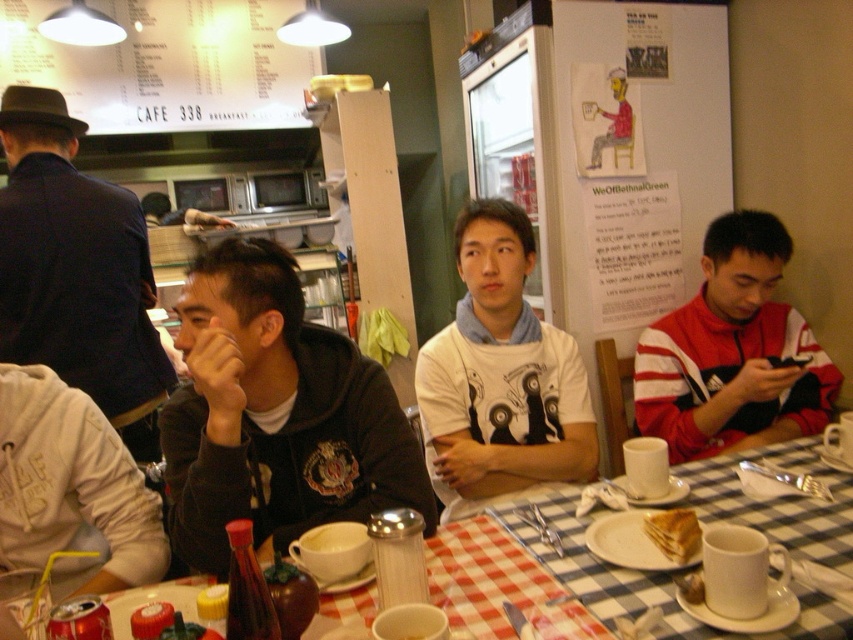
Question: Considering the relative positions of white matte t-shirt at center and checkered fabric tablecloth at lower center in the image provided, where is white matte t-shirt at center located with respect to checkered fabric tablecloth at lower center?

Choices:
 (A) left
 (B) right

Answer: (A)

Question: Which object appears closest to the camera in this image?

Choices:
 (A) checkered fabric table at center
 (B) golden crispy pastry at lower center
 (C) red and white striped hoodie at right
 (D) checkered fabric tablecloth at lower center

Answer: (D)

Question: Which object appears closest to the camera in this image?

Choices:
 (A) white matte plate at center
 (B) golden crispy pastry at lower center

Answer: (B)

Question: Which point is closer to the camera?

Choices:
 (A) dark gray hoodie at center
 (B) golden crispy pastry at lower center
 (C) white matte plate at center
 (D) checkered fabric table at center

Answer: (D)

Question: Is checkered fabric tablecloth at lower center to the left of golden crispy pastry at lower center from the viewer's perspective?

Choices:
 (A) no
 (B) yes

Answer: (A)

Question: Is checkered fabric table at center positioned at the back of golden crispy pastry at lower center?

Choices:
 (A) no
 (B) yes

Answer: (A)